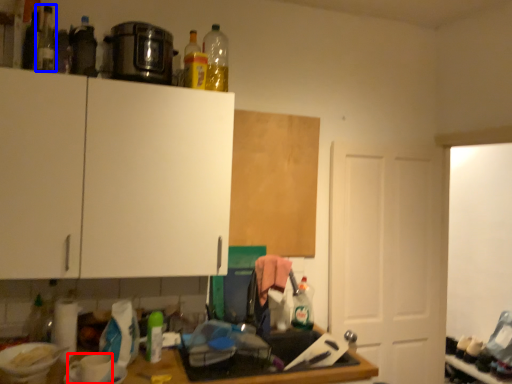
Question: Among these objects, which one is nearest to the camera, coffee cup (highlighted by a red box) or bottle (highlighted by a blue box)?

Choices:
 (A) coffee cup
 (B) bottle

Answer: (A)